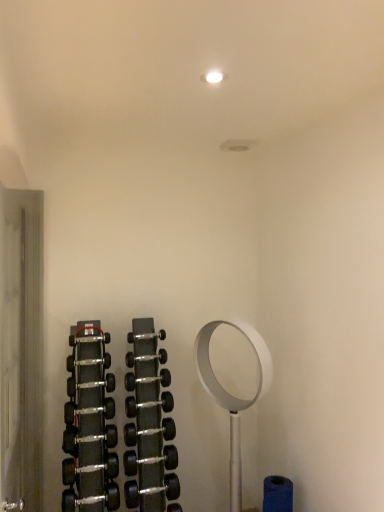
Question: Does black rubber dumbbell at center, which is the fifth dumbbell in bottom-to-top order, appear on the left side of black rubber dumbbell at center, which is the 6th dumbbell from top to bottom?

Choices:
 (A) yes
 (B) no

Answer: (A)

Question: Are black rubber dumbbell at center, which ranks as the 4th dumbbell in top-to-bottom order, and black rubber dumbbell at center, the third dumbbell positioned from the bottom, far apart?

Choices:
 (A) yes
 (B) no

Answer: (B)

Question: From a real-world perspective, is black rubber dumbbell at center, which is the fifth dumbbell in bottom-to-top order, positioned over black rubber dumbbell at center, which is the 6th dumbbell from top to bottom, based on gravity?

Choices:
 (A) yes
 (B) no

Answer: (A)

Question: Considering the relative sizes of black rubber dumbbell at center, which is the fifth dumbbell in bottom-to-top order, and black rubber dumbbell at center, which is the 6th dumbbell from top to bottom, in the image provided, is black rubber dumbbell at center, which is the fifth dumbbell in bottom-to-top order, thinner than black rubber dumbbell at center, which is the 6th dumbbell from top to bottom,?

Choices:
 (A) yes
 (B) no

Answer: (A)

Question: Does black rubber dumbbell at center, which ranks as the 4th dumbbell in top-to-bottom order, have a lesser height compared to black rubber dumbbell at center, the third dumbbell positioned from the bottom?

Choices:
 (A) no
 (B) yes

Answer: (B)

Question: Choose the correct answer: Is black rubber dumbbell at center, which is the 6th dumbbell in bottom-to-top order, inside black rubber dumbbell at center, which ranks as the 4th dumbbell in top-to-bottom order, or outside it?

Choices:
 (A) inside
 (B) outside

Answer: (B)

Question: From a real-world perspective, is black rubber dumbbell at center, the third dumbbell from the top, above or below black rubber dumbbell at center, which ranks as the 4th dumbbell in top-to-bottom order?

Choices:
 (A) below
 (B) above

Answer: (B)

Question: Relative to black rubber dumbbell at center, which is the fifth dumbbell in bottom-to-top order, is black rubber dumbbell at center, which is the 6th dumbbell in bottom-to-top order, in front or behind?

Choices:
 (A) behind
 (B) front

Answer: (B)

Question: From the image's perspective, is black rubber dumbbell at center, which is the 6th dumbbell in bottom-to-top order, positioned above or below black rubber dumbbell at center, which is the fifth dumbbell in bottom-to-top order?

Choices:
 (A) below
 (B) above

Answer: (B)

Question: In the image, is black metallic dumbbell at center, the first dumbbell positioned from the bottom, on the left side or the right side of black rubber dumbbell at center, the third dumbbell from the top?

Choices:
 (A) left
 (B) right

Answer: (B)

Question: From the image's perspective, is black metallic dumbbell at center, which is the eighth dumbbell in top-to-bottom order, located above or below black rubber dumbbell at center, the third dumbbell from the top?

Choices:
 (A) above
 (B) below

Answer: (B)

Question: Considering the positions of black metallic dumbbell at center, which is the eighth dumbbell in top-to-bottom order, and black rubber dumbbell at center, the third dumbbell from the top, in the image, is black metallic dumbbell at center, which is the eighth dumbbell in top-to-bottom order, taller or shorter than black rubber dumbbell at center, the third dumbbell from the top,?

Choices:
 (A) short
 (B) tall

Answer: (B)

Question: From a real-world perspective, relative to black rubber dumbbell at center, which is the 6th dumbbell in bottom-to-top order, is black metallic dumbbell at center, which is the eighth dumbbell in top-to-bottom order, vertically above or below?

Choices:
 (A) above
 (B) below

Answer: (B)

Question: From the image's perspective, is black rubber dumbbell at center, the third dumbbell positioned from the bottom, above or below black rubber dumbbell at lower left, which is the seventh dumbbell from top to bottom?

Choices:
 (A) below
 (B) above

Answer: (B)

Question: In the image, is black rubber dumbbell at center, the third dumbbell positioned from the bottom, positioned in front of or behind black rubber dumbbell at lower left, which is the seventh dumbbell from top to bottom?

Choices:
 (A) front
 (B) behind

Answer: (B)